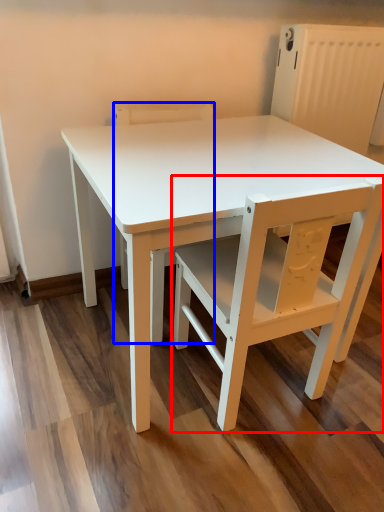
Question: Among these objects, which one is nearest to the camera, chair (highlighted by a red box) or chair (highlighted by a blue box)?

Choices:
 (A) chair
 (B) chair

Answer: (A)